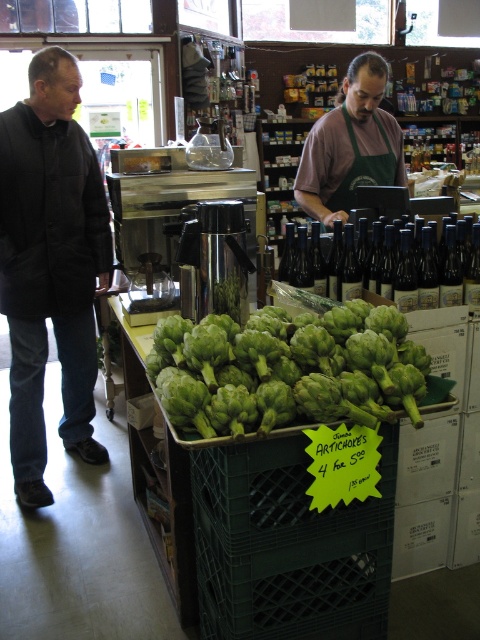
Is green matte artichoke at center thinner than green apron at center?

In fact, green matte artichoke at center might be wider than green apron at center.

Who is shorter, green matte artichoke at center or green apron at center?

With less height is green matte artichoke at center.

Between point (340, 380) and point (355, 147), which one is positioned behind?

The point (355, 147) is more distant.

The height and width of the screenshot is (640, 480). I want to click on green matte artichoke at center, so click(285, 371).

Between point (20, 237) and point (403, 307), which one is positioned behind?

The point (20, 237) is more distant.

Image resolution: width=480 pixels, height=640 pixels. Identify the location of black matte jacket at left. (50, 266).

Can you confirm if black matte jacket at left is thinner than green apron at center?

Correct, black matte jacket at left's width is less than green apron at center's.

Who is positioned more to the right, black matte jacket at left or green apron at center?

Positioned to the right is green apron at center.

Find the location of a particular element. The height and width of the screenshot is (640, 480). black matte jacket at left is located at coordinates (50, 266).